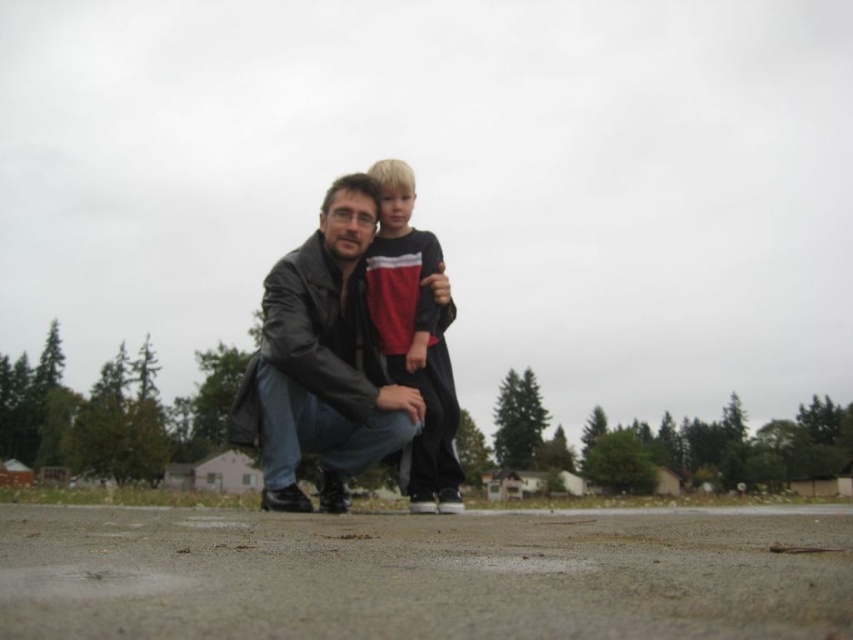
Question: Among these points, which one is nearest to the camera?

Choices:
 (A) (422, 483)
 (B) (358, 442)

Answer: (A)

Question: Which object appears farthest from the camera in this image?

Choices:
 (A) leather jacket at center
 (B) matte black shirt at center

Answer: (B)

Question: Is leather jacket at center wider than matte black shirt at center?

Choices:
 (A) no
 (B) yes

Answer: (B)

Question: Is leather jacket at center wider than matte black shirt at center?

Choices:
 (A) no
 (B) yes

Answer: (B)

Question: Is leather jacket at center positioned at the back of matte black shirt at center?

Choices:
 (A) yes
 (B) no

Answer: (B)